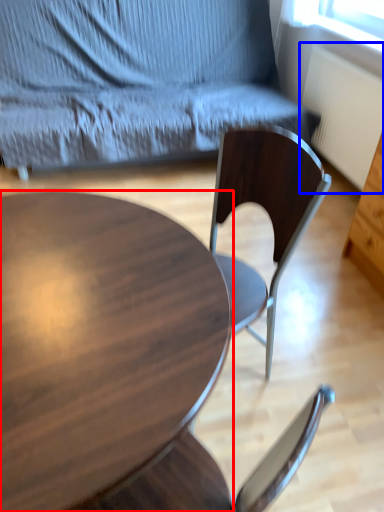
Question: Among these objects, which one is nearest to the camera, coffee table (highlighted by a red box) or radiator (highlighted by a blue box)?

Choices:
 (A) coffee table
 (B) radiator

Answer: (A)